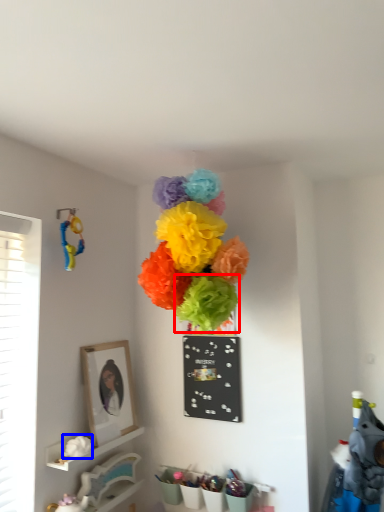
Question: Which object is closer to the camera taking this photo, flower (highlighted by a red box) or flower (highlighted by a blue box)?

Choices:
 (A) flower
 (B) flower

Answer: (B)